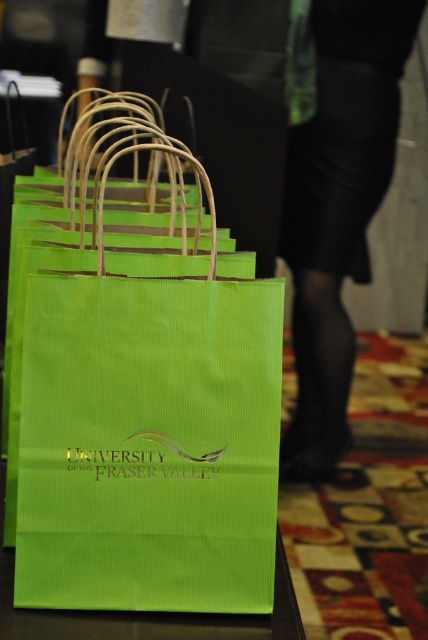
Is green paper bag at center positioned in front of matte green paper bag at lower left?

That is True.

Which is behind, point (281, 326) or point (332, 323)?

The point (332, 323) is more distant.

Does point (109, 138) lie in front of point (359, 148)?

That is True.

In order to click on green paper bag at center in this screenshot , I will do `click(145, 401)`.